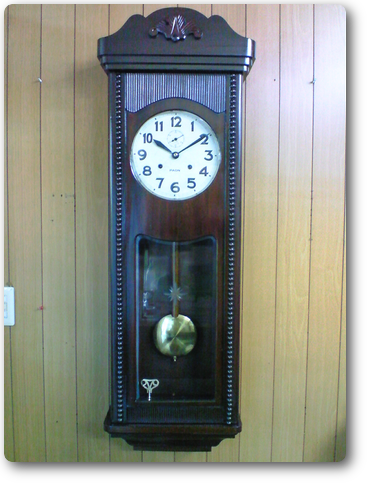
Where is `clock`? The image size is (367, 483). clock is located at coordinates (183, 218).